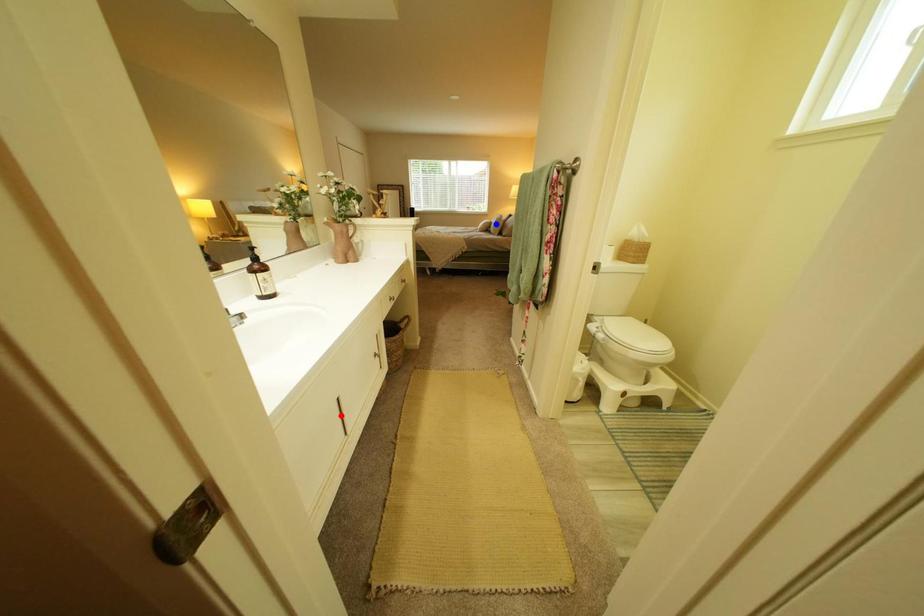
Question: In the image, two points are highlighted. Which point is nearer to the camera? Reply with the corresponding letter.

Choices:
 (A) blue point
 (B) red point

Answer: (B)